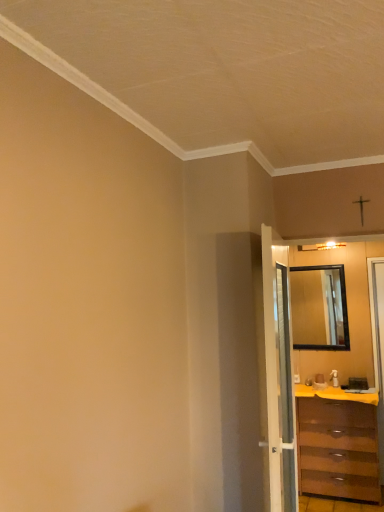
Question: In terms of height, does yellow matte counter top at lower right look taller or shorter compared to brown wooden chest of drawers at right?

Choices:
 (A) short
 (B) tall

Answer: (A)

Question: Is yellow matte counter top at lower right spatially inside brown wooden chest of drawers at right, or outside of it?

Choices:
 (A) inside
 (B) outside

Answer: (A)

Question: Considering the real-world distances, which object is farthest from the yellow matte counter top at lower right?

Choices:
 (A) black glass mirror at right
 (B) white glossy door at center
 (C) brown wooden chest of drawers at right

Answer: (B)

Question: Estimate the real-world distances between objects in this image. Which object is farther from the black glass mirror at right?

Choices:
 (A) white glossy door at center
 (B) brown wooden chest of drawers at right
 (C) yellow matte counter top at lower right

Answer: (A)